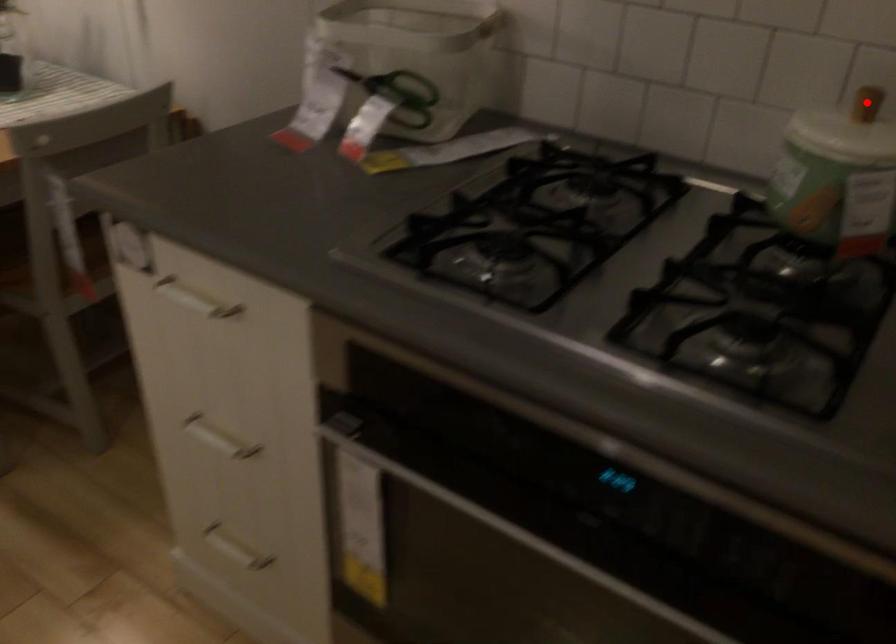
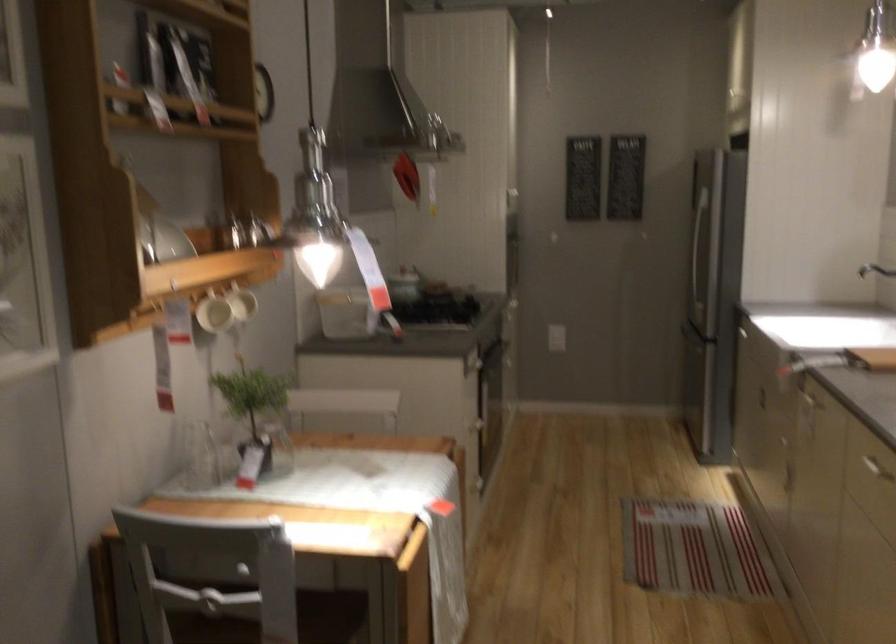
Question: I am providing you with two images of the same scene from different viewpoints. A red point is marked on the first image. Is the red point's position out of view in image 2?

Choices:
 (A) Yes
 (B) No

Answer: (A)